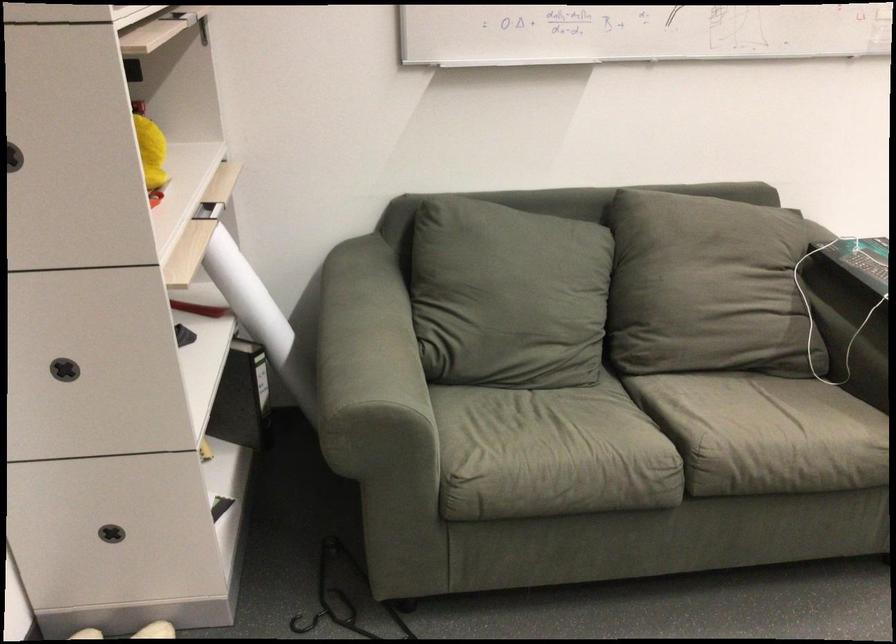
Find where to lift the yellow yarn ball. Please return your answer as a coordinate pair (x, y).

(151, 152)